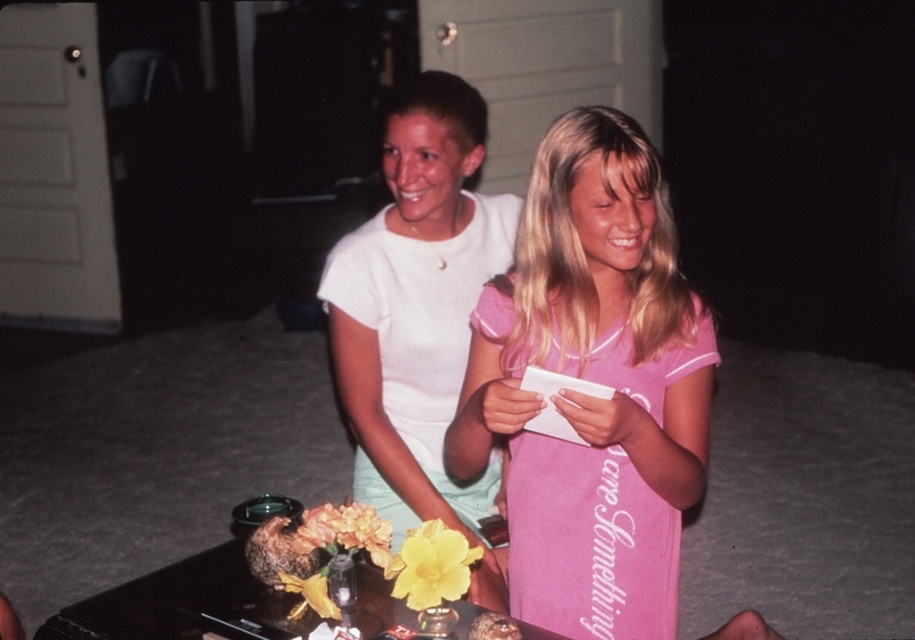
You are standing in the living room and want to take a photo of the white matte shirt at center. Where should you position yourself to capture it in the frame?

The white matte shirt at center is located at point [417,305], so you should position yourself directly in front of that coordinate to capture it in the frame.

You are organizing a small gathering and want to ensure there is enough space for both the pink cotton dress at center and the black glossy table at lower center. Based on their sizes, which one requires more space?

The pink cotton dress at center requires more space because it is bigger than the black glossy table at lower center.

You are a delivery robot with a 12 inch wide package. You need to place it on the smooth brown bread at lower center without getting too close to the white matte shirt at center. Can you do it?

The white matte shirt at center is 30.39 inches away from the smooth brown bread at lower center. Since the package is only 12 inches wide, there is enough space between them to place the package safely without getting too close.